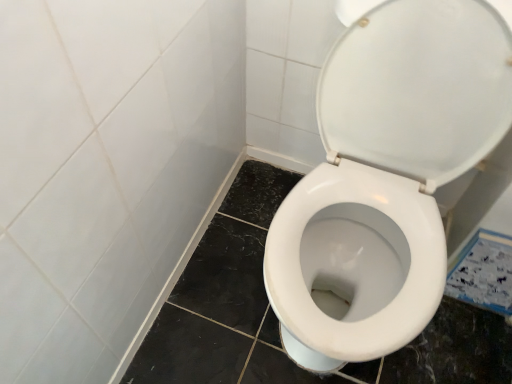
Question: Considering the relative sizes of white glossy toilet at center and white glossy ceramic tile at lower right in the image provided, is white glossy toilet at center bigger than white glossy ceramic tile at lower right?

Choices:
 (A) yes
 (B) no

Answer: (A)

Question: Does white glossy toilet at center have a lesser height compared to white glossy ceramic tile at lower right?

Choices:
 (A) yes
 (B) no

Answer: (B)

Question: From a real-world perspective, is white glossy toilet at center under white glossy ceramic tile at lower right?

Choices:
 (A) no
 (B) yes

Answer: (A)

Question: From a real-world perspective, is white glossy toilet at center positioned over white glossy ceramic tile at lower right based on gravity?

Choices:
 (A) yes
 (B) no

Answer: (A)

Question: Is white glossy toilet at center surrounding white glossy ceramic tile at lower right?

Choices:
 (A) yes
 (B) no

Answer: (B)

Question: Considering the relative positions of white glossy toilet at center and white glossy ceramic tile at lower right in the image provided, is white glossy toilet at center to the right of white glossy ceramic tile at lower right from the viewer's perspective?

Choices:
 (A) yes
 (B) no

Answer: (B)

Question: Considering the relative sizes of white glossy ceramic tile at lower right and white glossy toilet at center in the image provided, is white glossy ceramic tile at lower right wider than white glossy toilet at center?

Choices:
 (A) no
 (B) yes

Answer: (A)

Question: Is white glossy toilet at center located within white glossy ceramic tile at lower right?

Choices:
 (A) yes
 (B) no

Answer: (B)

Question: Can you confirm if white glossy ceramic tile at lower right is bigger than white glossy toilet at center?

Choices:
 (A) yes
 (B) no

Answer: (B)

Question: Can you confirm if white glossy ceramic tile at lower right is smaller than white glossy toilet at center?

Choices:
 (A) no
 (B) yes

Answer: (B)

Question: From the image's perspective, does white glossy ceramic tile at lower right appear higher than white glossy toilet at center?

Choices:
 (A) no
 (B) yes

Answer: (A)

Question: Is white glossy ceramic tile at lower right far from white glossy toilet at center?

Choices:
 (A) yes
 (B) no

Answer: (B)

Question: In terms of height, does white glossy toilet at center look taller or shorter compared to white glossy ceramic tile at lower right?

Choices:
 (A) short
 (B) tall

Answer: (B)